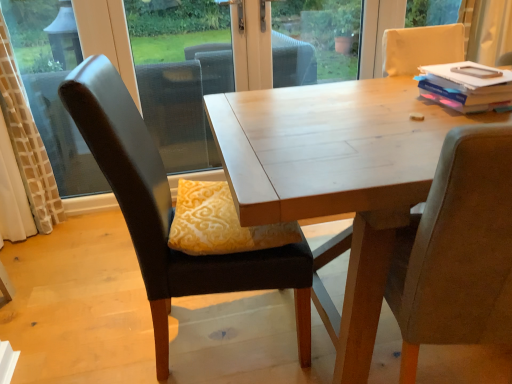
You are a GUI agent. You are given a task and a screenshot of the screen. Output one action in this format:
    pyautogui.click(x=<x>, y=<y>)
    Task: Click on the yellow velvet pillow at center
    
    Given the screenshot: What is the action you would take?
    pyautogui.click(x=219, y=223)

This screenshot has width=512, height=384. What are the coordinates of `book located above the matte gray chair at right, which is the second chair in left-to-right order (from a real-world perspective)` in the screenshot? It's located at [463, 88].

Is hardcover book at upper right bigger than matte gray chair at right, which is the 1th chair in right-to-left order?

No, hardcover book at upper right is not bigger than matte gray chair at right, which is the 1th chair in right-to-left order.

In terms of height, does hardcover book at upper right look taller or shorter compared to matte gray chair at right, which is the 1th chair in right-to-left order?

In the image, hardcover book at upper right appears to be shorter than matte gray chair at right, which is the 1th chair in right-to-left order.

I want to click on pillow below the hardcover book at upper right (from the image's perspective), so click(219, 223).

Is point (247, 243) positioned in front of point (422, 94)?

Yes, it is in front of point (422, 94).

What's the angular difference between yellow velvet pillow at center and hardcover book at upper right's facing directions?

92.5 degrees separate the facing orientations of yellow velvet pillow at center and hardcover book at upper right.

Can you see matte gray chair at right, which is the second chair in left-to-right order, touching hardcover book at upper right?

matte gray chair at right, which is the second chair in left-to-right order, is not next to hardcover book at upper right, and they're not touching.

Does matte gray chair at right, which is the second chair in left-to-right order, have a greater width compared to hardcover book at upper right?

Indeed, matte gray chair at right, which is the second chair in left-to-right order, has a greater width compared to hardcover book at upper right.

Is matte gray chair at right, which is the second chair in left-to-right order, located outside hardcover book at upper right?

Absolutely, matte gray chair at right, which is the second chair in left-to-right order, is external to hardcover book at upper right.

Does matte gray chair at right, which is the 1th chair in right-to-left order, have a lesser height compared to hardcover book at upper right?

No, matte gray chair at right, which is the 1th chair in right-to-left order, is not shorter than hardcover book at upper right.

Can you confirm if yellow velvet pillow at center is bigger than matte black chair at left, the first chair from the left?

Actually, yellow velvet pillow at center might be smaller than matte black chair at left, the first chair from the left.

From a real-world perspective, is yellow velvet pillow at center physically located above or below matte black chair at left, the first chair from the left?

yellow velvet pillow at center is above matte black chair at left, the first chair from the left.

Looking at their sizes, would you say yellow velvet pillow at center is wider or thinner than matte black chair at left, the second chair when ordered from right to left?

Considering their sizes, yellow velvet pillow at center looks slimmer than matte black chair at left, the second chair when ordered from right to left.

In terms of height, does yellow velvet pillow at center look taller or shorter compared to matte black chair at left, the second chair when ordered from right to left?

Clearly, yellow velvet pillow at center is shorter compared to matte black chair at left, the second chair when ordered from right to left.

Is yellow velvet pillow at center with matte gray chair at right, which is the 1th chair in right-to-left order?

No, yellow velvet pillow at center is not touching matte gray chair at right, which is the 1th chair in right-to-left order.

Can you confirm if yellow velvet pillow at center is bigger than matte gray chair at right, which is the second chair in left-to-right order?

No, yellow velvet pillow at center is not bigger than matte gray chair at right, which is the second chair in left-to-right order.

From the image's perspective, which chair is the 2nd one below the yellow velvet pillow at center? Please provide its 2D coordinates.

[(457, 250)]

Who is smaller, hardcover book at upper right or yellow velvet pillow at center?

Smaller between the two is hardcover book at upper right.

How many degrees apart are the facing directions of hardcover book at upper right and yellow velvet pillow at center?

There is a 92.5-degree angle between the facing directions of hardcover book at upper right and yellow velvet pillow at center.

Is hardcover book at upper right aimed at yellow velvet pillow at center?

No, hardcover book at upper right is not aimed at yellow velvet pillow at center.

Are hardcover book at upper right and yellow velvet pillow at center far apart?

That's not correct — hardcover book at upper right is a little close to yellow velvet pillow at center.

In the scene shown: Is there a large distance between matte black chair at left, the first chair from the left, and matte gray chair at right, which is the 1th chair in right-to-left order?

No, matte black chair at left, the first chair from the left, is not far from matte gray chair at right, which is the 1th chair in right-to-left order.

Does matte black chair at left, the second chair when ordered from right to left, have a lesser height compared to matte gray chair at right, which is the 1th chair in right-to-left order?

No, matte black chair at left, the second chair when ordered from right to left, is not shorter than matte gray chair at right, which is the 1th chair in right-to-left order.

The height and width of the screenshot is (384, 512). What are the coordinates of `chair above the matte gray chair at right, which is the 1th chair in right-to-left order (from the image's perspective)` in the screenshot? It's located at (169, 212).

Can you confirm if matte black chair at left, the second chair when ordered from right to left, is wider than matte gray chair at right, which is the 1th chair in right-to-left order?

Yes, matte black chair at left, the second chair when ordered from right to left, is wider than matte gray chair at right, which is the 1th chair in right-to-left order.

Where is `book above the matte gray chair at right, which is the 1th chair in right-to-left order (from the image's perspective)`? This screenshot has height=384, width=512. book above the matte gray chair at right, which is the 1th chair in right-to-left order (from the image's perspective) is located at coordinates (463, 88).

You are a GUI agent. You are given a task and a screenshot of the screen. Output one action in this format:
    pyautogui.click(x=<x>, y=<y>)
    Task: Click on the book on the right side of yellow velvet pillow at center
    The width and height of the screenshot is (512, 384).
    Given the screenshot: What is the action you would take?
    pyautogui.click(x=463, y=88)

Looking at the image, which one is located closer to matte black chair at left, the second chair when ordered from right to left, yellow velvet pillow at center or matte gray chair at right, which is the 1th chair in right-to-left order?

Based on the image, yellow velvet pillow at center appears to be nearer to matte black chair at left, the second chair when ordered from right to left.

Which object lies further to the anchor point matte black chair at left, the first chair from the left, hardcover book at upper right or matte gray chair at right, which is the 1th chair in right-to-left order?

The object further to matte black chair at left, the first chair from the left, is hardcover book at upper right.

Which object lies further to the anchor point matte gray chair at right, which is the second chair in left-to-right order, hardcover book at upper right or yellow velvet pillow at center?

hardcover book at upper right is further to matte gray chair at right, which is the second chair in left-to-right order.

From the picture: Looking at the image, which one is located further to matte gray chair at right, which is the 1th chair in right-to-left order, yellow velvet pillow at center or matte black chair at left, the second chair when ordered from right to left?

Based on the image, matte black chair at left, the second chair when ordered from right to left, appears to be further to matte gray chair at right, which is the 1th chair in right-to-left order.

Estimate the real-world distances between objects in this image. Which object is closer to hardcover book at upper right, matte black chair at left, the second chair when ordered from right to left, or matte gray chair at right, which is the 1th chair in right-to-left order?

Among the two, matte gray chair at right, which is the 1th chair in right-to-left order, is located nearer to hardcover book at upper right.

Which object lies nearer to the anchor point matte gray chair at right, which is the second chair in left-to-right order, hardcover book at upper right or matte black chair at left, the first chair from the left?

matte black chair at left, the first chair from the left, lies closer to matte gray chair at right, which is the second chair in left-to-right order, than the other object.

From the image, which object appears to be nearer to yellow velvet pillow at center, matte gray chair at right, which is the 1th chair in right-to-left order, or hardcover book at upper right?

The object closer to yellow velvet pillow at center is matte gray chair at right, which is the 1th chair in right-to-left order.

Which object lies further to the anchor point yellow velvet pillow at center, matte black chair at left, the first chair from the left, or hardcover book at upper right?

hardcover book at upper right lies further to yellow velvet pillow at center than the other object.

Locate an element on the screen. pillow between matte black chair at left, the second chair when ordered from right to left, and matte gray chair at right, which is the 1th chair in right-to-left order, from left to right is located at coordinates (219, 223).

You are a GUI agent. You are given a task and a screenshot of the screen. Output one action in this format:
    pyautogui.click(x=<x>, y=<y>)
    Task: Click on the chair between matte black chair at left, the second chair when ordered from right to left, and hardcover book at upper right from left to right
    
    Given the screenshot: What is the action you would take?
    pyautogui.click(x=457, y=250)

You are a GUI agent. You are given a task and a screenshot of the screen. Output one action in this format:
    pyautogui.click(x=<x>, y=<y>)
    Task: Click on the chair between yellow velvet pillow at center and hardcover book at upper right
    
    Given the screenshot: What is the action you would take?
    pyautogui.click(x=457, y=250)

This screenshot has width=512, height=384. Identify the location of pillow between matte black chair at left, the second chair when ordered from right to left, and hardcover book at upper right. (219, 223).